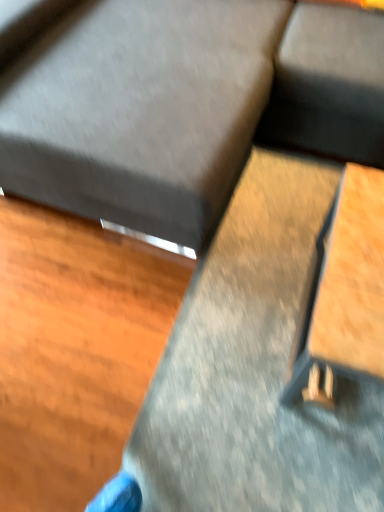
In order to click on vacant space in textured gray concrete at center (from a real-world perspective) in this screenshot , I will do click(x=258, y=408).